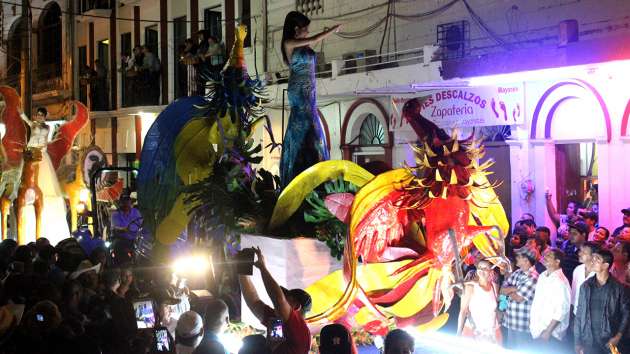
Find the location of a particular element. The image size is (630, 354). doorway is located at coordinates (586, 161).